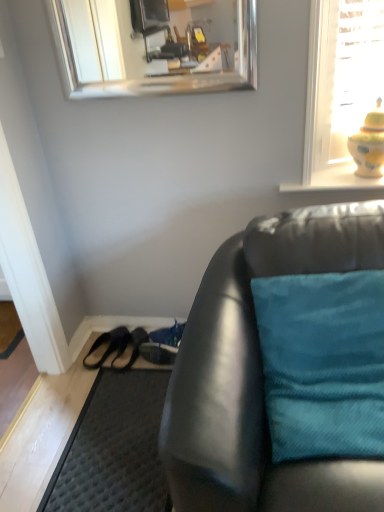
Question: Is dark gray textured doormat at lower left spatially inside teal fabric pillow at right, or outside of it?

Choices:
 (A) outside
 (B) inside

Answer: (A)

Question: From a real-world perspective, is dark gray textured doormat at lower left positioned above or below teal fabric pillow at right?

Choices:
 (A) below
 (B) above

Answer: (A)

Question: Which of these objects is positioned farthest from the yellow glazed vase at upper right?

Choices:
 (A) silver/metallic mirror at upper center
 (B) matte black couch at lower right
 (C) shiny blue shoe at lower center, the third shoe positioned from the left
 (D) dark gray textured doormat at lower left
 (E) teal fabric pillow at right

Answer: (A)

Question: Which object is the farthest from the yellow glazed vase at upper right?

Choices:
 (A) dark gray textured doormat at lower left
 (B) silver/metallic mirror at upper center
 (C) shiny blue shoe at lower center, the third shoe positioned from the left
 (D) matte black couch at lower right
 (E) teal fabric pillow at right

Answer: (B)